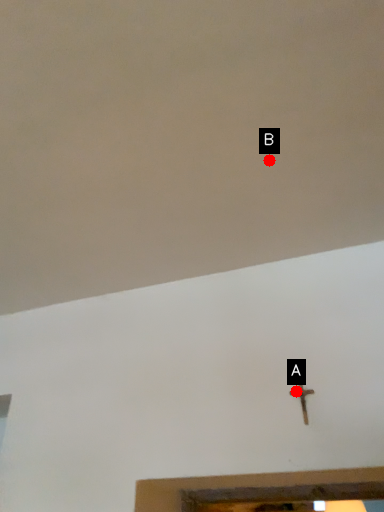
Question: Two points are circled on the image, labeled by A and B beside each circle. Which point appears farthest from the camera in this image?

Choices:
 (A) A is further
 (B) B is further

Answer: (A)